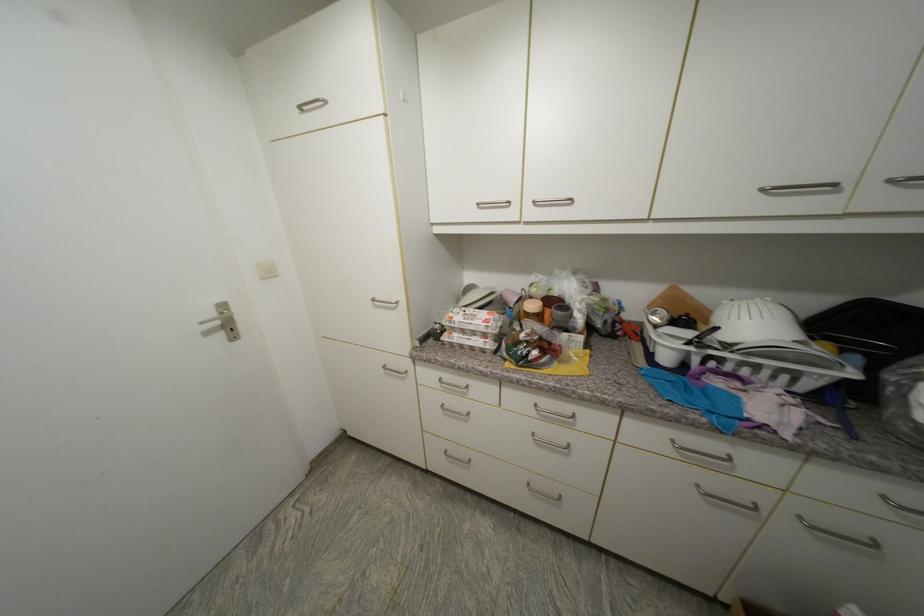
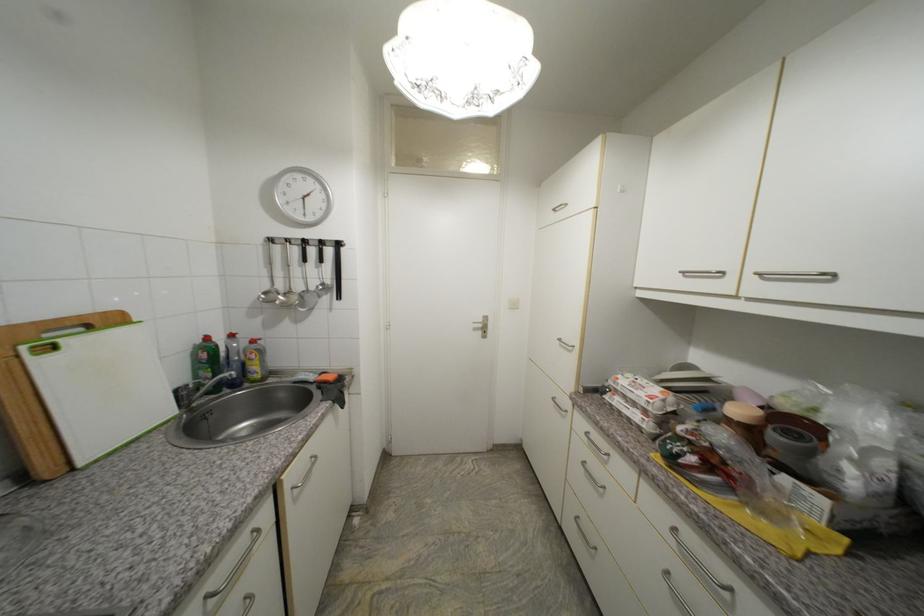
Question: The camera is either moving clockwise (left) or counter-clockwise (right) around the object. The first image is from the beginning of the video and the second image is from the end. Is the camera moving left or right when shooting the video?

Choices:
 (A) Left
 (B) Right

Answer: (B)